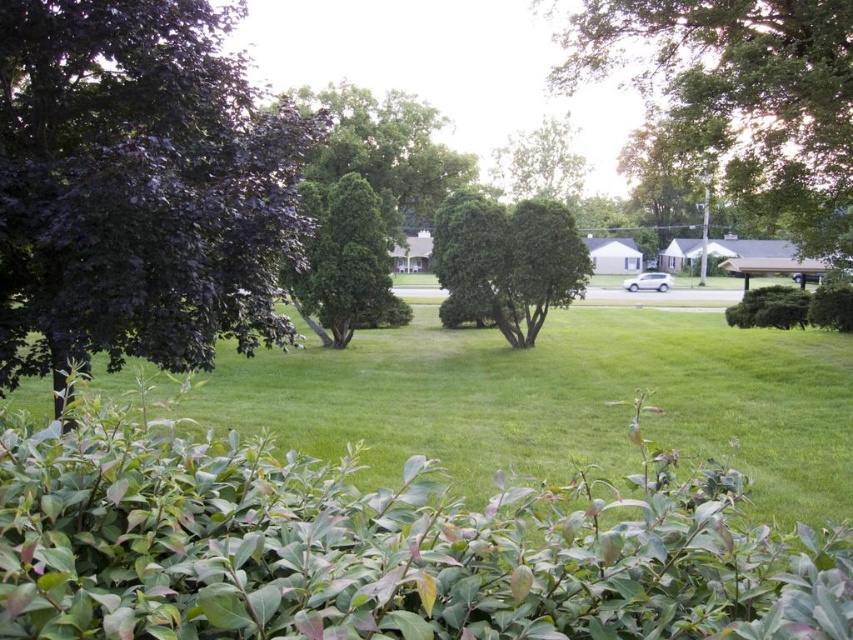
Image resolution: width=853 pixels, height=640 pixels. What do you see at coordinates (746, 93) in the screenshot?
I see `green leafy tree at upper right` at bounding box center [746, 93].

Does green leafy tree at upper right have a greater width compared to green leafy bush at center?

Yes.

Is point (766, 152) farther from viewer compared to point (489, 225)?

That is False.

What are the coordinates of `green leafy tree at upper right` in the screenshot? It's located at (746, 93).

Can you confirm if green leafy bush at center is positioned above green leafy hedge at right?

Yes.

Who is positioned more to the left, green leafy bush at center or green leafy hedge at right?

green leafy bush at center

Does point (482, 244) come farther from viewer compared to point (749, 305)?

No, it is in front of (749, 305).

This screenshot has height=640, width=853. I want to click on green leafy bush at center, so click(x=508, y=260).

Does green grass at center have a greater height compared to green leafy tree at center?

No, green grass at center is not taller than green leafy tree at center.

This screenshot has width=853, height=640. What do you see at coordinates (561, 401) in the screenshot? I see `green grass at center` at bounding box center [561, 401].

Who is more distant from viewer, (505, 376) or (396, 324)?

The point (396, 324) is more distant.

At what (x,y) coordinates should I click in order to perform the action: click on green grass at center. Please return your answer as a coordinate pair (x, y). The height and width of the screenshot is (640, 853). Looking at the image, I should click on (561, 401).